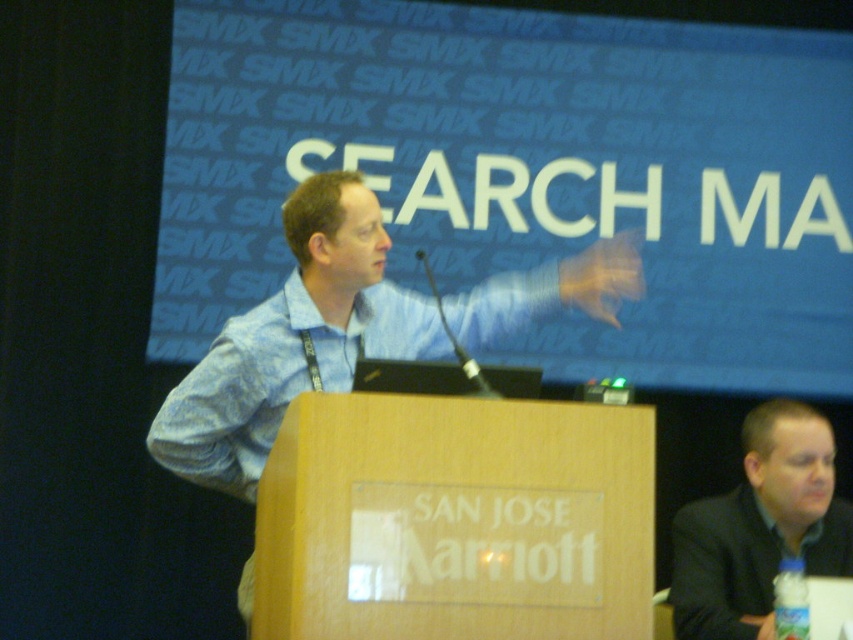
Consider the image. You are an attendee at the conference. You see the blue shirt at center and the dark gray suit at lower right. Which one is positioned more to the left side of the scene?

The blue shirt at center is positioned more to the left side of the scene than the dark gray suit at lower right.

Based on the scene, where is the blue shirt at center located in terms of coordinates?

The blue shirt at center is located at coordinates point (x=350, y=328).

You are an event photographer who needs to capture a clear shot of the speaker. You notice the blue shirt at center and the dark gray suit at lower right. Which clothing item should you focus on to ensure it appears larger in your photo?

The blue shirt at center is larger in size than the dark gray suit at lower right, so focusing on the blue shirt at center will ensure it appears larger in the photo.